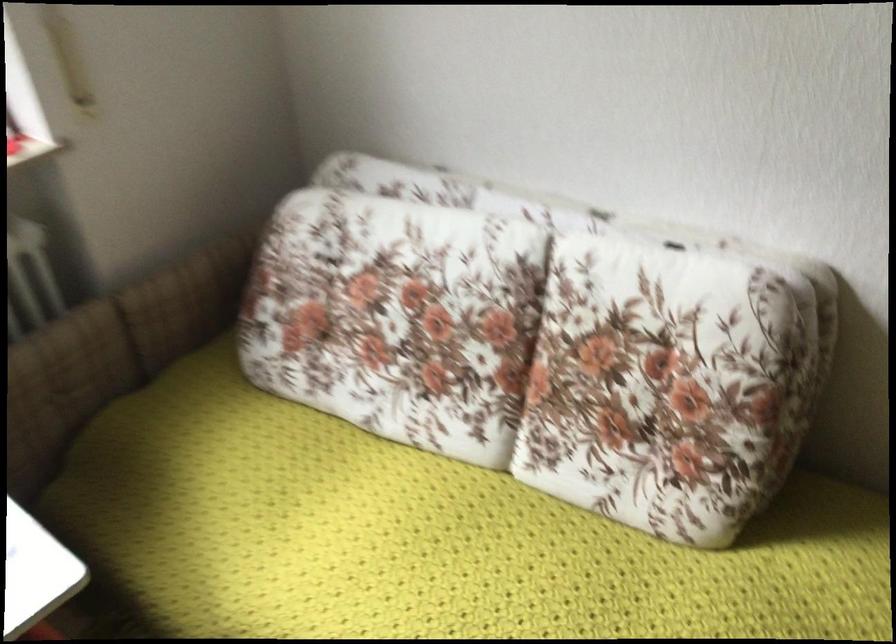
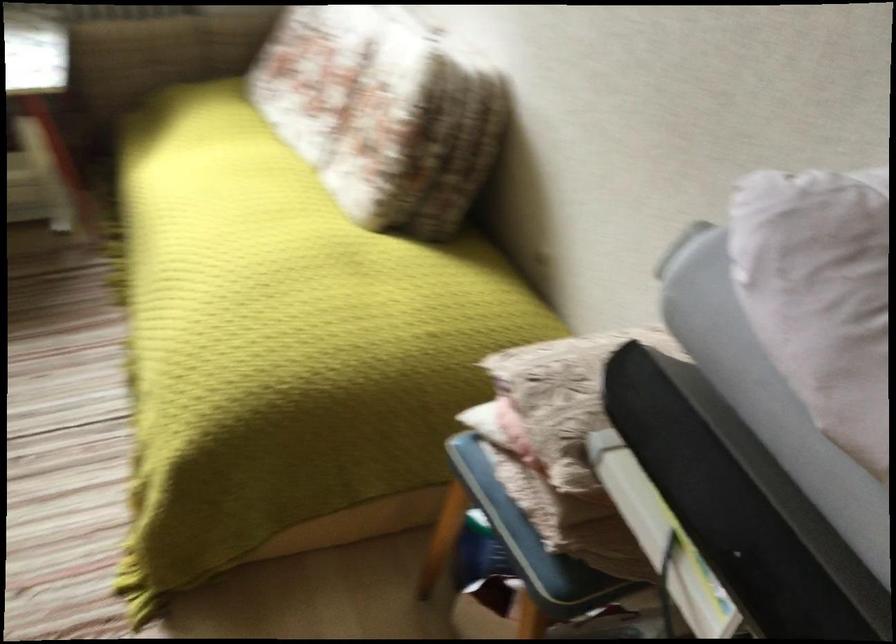
In the second image, find the point that corresponds to [667,372] in the first image.

(382, 114)